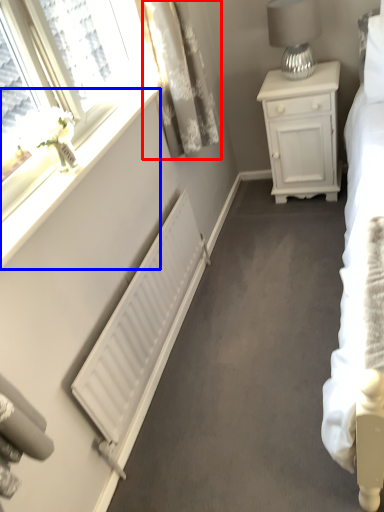
Question: Among these objects, which one is farthest to the camera, curtain (highlighted by a red box) or window sill (highlighted by a blue box)?

Choices:
 (A) curtain
 (B) window sill

Answer: (A)